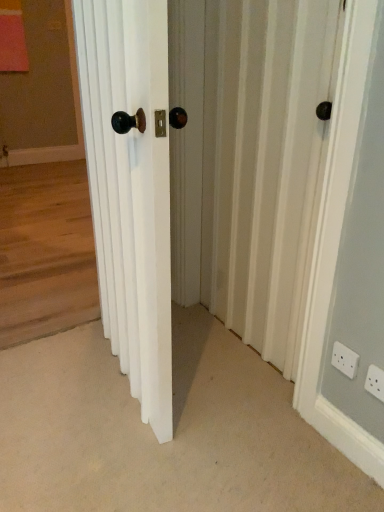
The height and width of the screenshot is (512, 384). Describe the element at coordinates (375, 382) in the screenshot. I see `white plastic electric outlet at lower right, the second electric outlet positioned from the left` at that location.

What do you see at coordinates (345, 360) in the screenshot? This screenshot has height=512, width=384. I see `white plastic electric outlet at lower right, positioned as the 2th electric outlet in right-to-left order` at bounding box center [345, 360].

Measure the distance between wooden floor at left and camera.

wooden floor at left is 1.81 meters away from camera.

Locate an element on the screen. This screenshot has width=384, height=512. wooden floor at left is located at coordinates (44, 186).

Where is `white plastic electric outlet at lower right, the second electric outlet positioned from the left`? This screenshot has height=512, width=384. white plastic electric outlet at lower right, the second electric outlet positioned from the left is located at coordinates (375, 382).

This screenshot has width=384, height=512. There is a wooden floor at left. What are the coordinates of `the 1st electric outlet below it (from the image's perspective)` in the screenshot? It's located at (345, 360).

From a real-world perspective, which object rests below the other?

white plastic electric outlet at lower right, which is the 1th electric outlet from left to right, from a real-world perspective.

From the image's perspective, is wooden floor at left under white plastic electric outlet at lower right, the first electric outlet from the back?

Incorrect, from the image's perspective, wooden floor at left is higher than white plastic electric outlet at lower right, the first electric outlet from the back.

From the picture: Which object is thinner, wooden floor at left or white plastic electric outlet at lower right, positioned as the 2th electric outlet in right-to-left order?

white plastic electric outlet at lower right, positioned as the 2th electric outlet in right-to-left order.

From a real-world perspective, who is located higher, white plastic electric outlet at lower right, which is the 1th electric outlet from left to right, or white plastic electric outlet at lower right, placed as the first electric outlet when sorted from front to back?

In real-world perspective, white plastic electric outlet at lower right, which is the 1th electric outlet from left to right, is above.

Is white plastic electric outlet at lower right, which is the 1th electric outlet from left to right, positioned in front of white plastic electric outlet at lower right, positioned as the 1th electric outlet in right-to-left order?

No, white plastic electric outlet at lower right, which is the 1th electric outlet from left to right, is further to the viewer.

In the scene shown: Which is more to the right, white plastic electric outlet at lower right, which is the second electric outlet from front to back, or white plastic electric outlet at lower right, the second electric outlet positioned from the left?

white plastic electric outlet at lower right, the second electric outlet positioned from the left, is more to the right.

Could you measure the distance between white plastic electric outlet at lower right, which is the 1th electric outlet from left to right, and white plastic electric outlet at lower right, placed as the first electric outlet when sorted from front to back?

2.85 inches.

Which of these two, white plastic electric outlet at lower right, which is the second electric outlet from front to back, or white wooden door at center, is wider?

With larger width is white wooden door at center.

In the scene shown: Would you say white plastic electric outlet at lower right, which is the second electric outlet from front to back, is inside or outside white wooden door at center?

white plastic electric outlet at lower right, which is the second electric outlet from front to back, is located beyond the bounds of white wooden door at center.

Who is smaller, white plastic electric outlet at lower right, positioned as the 2th electric outlet in right-to-left order, or white wooden door at center?

With smaller size is white plastic electric outlet at lower right, positioned as the 2th electric outlet in right-to-left order.

Does point (164, 306) come behind point (64, 212)?

No.

From the image's perspective, which is below, white wooden door at center or wooden floor at left?

white wooden door at center, from the image's perspective.

Are white wooden door at center and wooden floor at left beside each other?

No.

From a real-world perspective, which object stands above the other?

wooden floor at left.

Considering the relative sizes of white plastic electric outlet at lower right, which is the 1th electric outlet from left to right, and wooden floor at left in the image provided, is white plastic electric outlet at lower right, which is the 1th electric outlet from left to right, thinner than wooden floor at left?

Yes.

How distant is white plastic electric outlet at lower right, the first electric outlet from the back, from wooden floor at left?

They are 3.05 meters apart.

Is wooden floor at left at the back of white plastic electric outlet at lower right, the first electric outlet from the back?

white plastic electric outlet at lower right, the first electric outlet from the back, is not turned away from wooden floor at left.

What's the angular difference between white plastic electric outlet at lower right, positioned as the 2th electric outlet in right-to-left order, and wooden floor at left's facing directions?

They differ by 90.8 degrees in their facing directions.

Which of these two, white plastic electric outlet at lower right, the second electric outlet when ordered from back to front, or wooden floor at left, is thinner?

white plastic electric outlet at lower right, the second electric outlet when ordered from back to front.

From their relative heights in the image, would you say white plastic electric outlet at lower right, positioned as the 1th electric outlet in right-to-left order, is taller or shorter than wooden floor at left?

In the image, white plastic electric outlet at lower right, positioned as the 1th electric outlet in right-to-left order, appears to be shorter than wooden floor at left.

From the image's perspective, between white plastic electric outlet at lower right, the second electric outlet when ordered from back to front, and wooden floor at left, which one is located above?

wooden floor at left.

Based on their positions, is white textured screen door at center located to the left or right of white plastic electric outlet at lower right, the second electric outlet when ordered from back to front?

Clearly, white textured screen door at center is on the left of white plastic electric outlet at lower right, the second electric outlet when ordered from back to front, in the image.

From the image's perspective, between white textured screen door at center and white plastic electric outlet at lower right, the second electric outlet positioned from the left, who is located below?

From the image's view, white plastic electric outlet at lower right, the second electric outlet positioned from the left, is below.

Considering the relative sizes of white textured screen door at center and white plastic electric outlet at lower right, positioned as the 1th electric outlet in right-to-left order, in the image provided, is white textured screen door at center taller than white plastic electric outlet at lower right, positioned as the 1th electric outlet in right-to-left order,?

Yes.

Identify the location of screen door lying on the left of white plastic electric outlet at lower right, positioned as the 1th electric outlet in right-to-left order. (264, 163).

Starting from the wooden floor at left, which electric outlet is the 1st one to the right? Please provide its 2D coordinates.

[(345, 360)]

Find the location of a particular element. electric outlet behind the white plastic electric outlet at lower right, placed as the first electric outlet when sorted from front to back is located at coordinates (345, 360).

Estimate the real-world distances between objects in this image. Which object is closer to white wooden door at center, wooden floor at left or white plastic electric outlet at lower right, the second electric outlet positioned from the left?

white plastic electric outlet at lower right, the second electric outlet positioned from the left, is positioned closer to the anchor white wooden door at center.

Estimate the real-world distances between objects in this image. Which object is closer to white wooden door at center, white textured screen door at center or white plastic electric outlet at lower right, which is the 1th electric outlet from left to right?

The object closer to white wooden door at center is white textured screen door at center.

Looking at the image, which one is located closer to white plastic electric outlet at lower right, the second electric outlet positioned from the left, white textured screen door at center or white wooden door at center?

white textured screen door at center is positioned closer to the anchor white plastic electric outlet at lower right, the second electric outlet positioned from the left.

Which object lies further to the anchor point white plastic electric outlet at lower right, positioned as the 2th electric outlet in right-to-left order, white textured screen door at center or white plastic electric outlet at lower right, the second electric outlet when ordered from back to front?

Among the two, white textured screen door at center is located further to white plastic electric outlet at lower right, positioned as the 2th electric outlet in right-to-left order.

Estimate the real-world distances between objects in this image. Which object is closer to white plastic electric outlet at lower right, placed as the first electric outlet when sorted from front to back, wooden floor at left or white textured screen door at center?

Based on the image, white textured screen door at center appears to be nearer to white plastic electric outlet at lower right, placed as the first electric outlet when sorted from front to back.

In the scene shown: Based on their spatial positions, is wooden floor at left or white wooden door at center closer to white textured screen door at center?

white wooden door at center is closer to white textured screen door at center.

Looking at the image, which one is located further to white plastic electric outlet at lower right, placed as the first electric outlet when sorted from front to back, white wooden door at center or wooden floor at left?

Among the two, wooden floor at left is located further to white plastic electric outlet at lower right, placed as the first electric outlet when sorted from front to back.

Which object lies further to the anchor point white plastic electric outlet at lower right, which is the second electric outlet from front to back, white wooden door at center or white plastic electric outlet at lower right, the second electric outlet when ordered from back to front?

white wooden door at center is further to white plastic electric outlet at lower right, which is the second electric outlet from front to back.

You are a GUI agent. You are given a task and a screenshot of the screen. Output one action in this format:
    pyautogui.click(x=<x>, y=<y>)
    Task: Click on the screen door located between wooden floor at left and white plastic electric outlet at lower right, which is the second electric outlet from front to back, in the left-right direction
    The image size is (384, 512).
    Given the screenshot: What is the action you would take?
    pyautogui.click(x=264, y=163)

Identify the location of door between wooden floor at left and white textured screen door at center from left to right. The width and height of the screenshot is (384, 512). (130, 190).

You are a GUI agent. You are given a task and a screenshot of the screen. Output one action in this format:
    pyautogui.click(x=<x>, y=<y>)
    Task: Click on the door situated between wooden floor at left and white plastic electric outlet at lower right, the first electric outlet from the back, from left to right
    
    Given the screenshot: What is the action you would take?
    pyautogui.click(x=130, y=190)

This screenshot has height=512, width=384. I want to click on electric outlet situated between wooden floor at left and white plastic electric outlet at lower right, placed as the first electric outlet when sorted from front to back, from left to right, so click(345, 360).